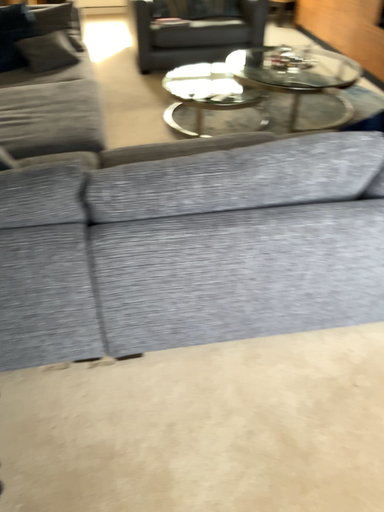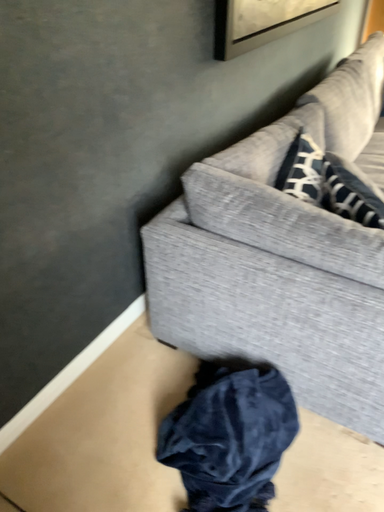
Question: How did the camera likely rotate when shooting the video?

Choices:
 (A) rotated upward
 (B) rotated downward

Answer: (A)